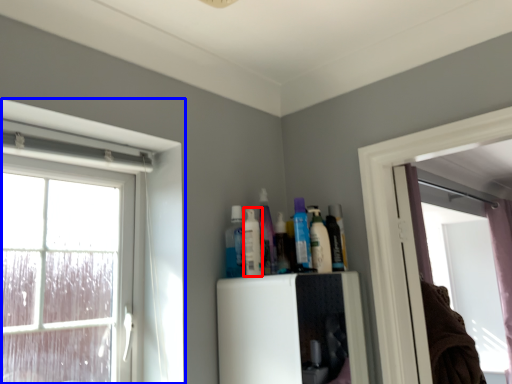
Question: Which of the following is the closest to the observer, toiletry (highlighted by a red box) or window (highlighted by a blue box)?

Choices:
 (A) toiletry
 (B) window

Answer: (B)